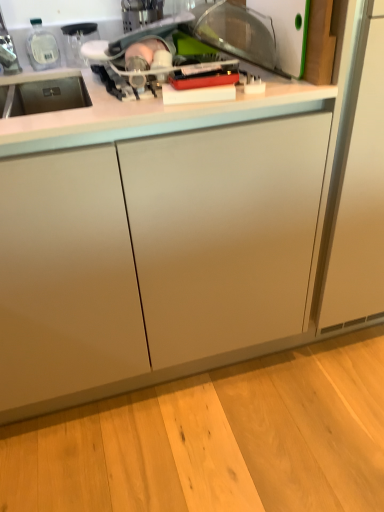
You are a GUI agent. You are given a task and a screenshot of the screen. Output one action in this format:
    pyautogui.click(x=<x>, y=<y>)
    Task: Click on the white glossy countertop at upper center
    This screenshot has height=512, width=384.
    Given the screenshot: What is the action you would take?
    pyautogui.click(x=150, y=117)

This screenshot has width=384, height=512. What do you see at coordinates (150, 117) in the screenshot? I see `white glossy countertop at upper center` at bounding box center [150, 117].

Locate an element on the screen. white plastic cutting board at upper right is located at coordinates (257, 32).

What do you see at coordinates (257, 32) in the screenshot? I see `white plastic cutting board at upper right` at bounding box center [257, 32].

Where is `white glossy countertop at upper center`? The image size is (384, 512). white glossy countertop at upper center is located at coordinates (150, 117).

Considering the relative positions of white plastic cutting board at upper right and white glossy countertop at upper center in the image provided, is white plastic cutting board at upper right to the right of white glossy countertop at upper center from the viewer's perspective?

Indeed, white plastic cutting board at upper right is positioned on the right side of white glossy countertop at upper center.

In the image, is white plastic cutting board at upper right positioned in front of or behind white glossy countertop at upper center?

white plastic cutting board at upper right is behind white glossy countertop at upper center.

Considering the points (251, 50) and (87, 87), which point is in front, point (251, 50) or point (87, 87)?

The point (87, 87) is closer.

From the image's perspective, is white plastic cutting board at upper right located above or below white glossy countertop at upper center?

Clearly, from the image's perspective, white plastic cutting board at upper right is above white glossy countertop at upper center.

From a real-world perspective, is white plastic cutting board at upper right positioned over white glossy countertop at upper center based on gravity?

No, from a real-world perspective, white plastic cutting board at upper right is not above white glossy countertop at upper center.

Can you confirm if white plastic cutting board at upper right is wider than white glossy countertop at upper center?

No, white plastic cutting board at upper right is not wider than white glossy countertop at upper center.

Can you confirm if white plastic cutting board at upper right is taller than white glossy countertop at upper center?

No, white plastic cutting board at upper right is not taller than white glossy countertop at upper center.

Between white plastic cutting board at upper right and white glossy countertop at upper center, which one has smaller size?

white plastic cutting board at upper right is smaller.

Could white glossy countertop at upper center be considered to be inside white plastic cutting board at upper right?

Actually, white glossy countertop at upper center is outside white plastic cutting board at upper right.

Would you say white plastic cutting board at upper right is a long distance from white glossy countertop at upper center?

white plastic cutting board at upper right is actually quite close to white glossy countertop at upper center.

Does white plastic cutting board at upper right turn towards white glossy countertop at upper center?

Yes, white plastic cutting board at upper right is oriented towards white glossy countertop at upper center.

What's the angular difference between white plastic cutting board at upper right and white glossy countertop at upper center's facing directions?

They differ by 87.7 degrees in their facing directions.

Measure the distance between white plastic cutting board at upper right and white glossy countertop at upper center.

white plastic cutting board at upper right is 7.50 inches from white glossy countertop at upper center.

Find the location of `appliance below the white glossy countertop at upper center (from a real-world perspective)`. appliance below the white glossy countertop at upper center (from a real-world perspective) is located at coordinates (257, 32).

Does white glossy countertop at upper center appear on the left side of white plastic cutting board at upper right?

Correct, you'll find white glossy countertop at upper center to the left of white plastic cutting board at upper right.

Which object is further away from the camera, white glossy countertop at upper center or white plastic cutting board at upper right?

white plastic cutting board at upper right is behind.

Is point (4, 135) closer to camera compared to point (284, 33)?

That is True.

From the image's perspective, would you say white glossy countertop at upper center is positioned over white plastic cutting board at upper right?

No, from the image's perspective, white glossy countertop at upper center is not over white plastic cutting board at upper right.

From a real-world perspective, is white glossy countertop at upper center positioned above or below white plastic cutting board at upper right?

white glossy countertop at upper center is situated higher than white plastic cutting board at upper right in the real world.

Which object is wider, white glossy countertop at upper center or white plastic cutting board at upper right?

Wider between the two is white glossy countertop at upper center.

Who is shorter, white glossy countertop at upper center or white plastic cutting board at upper right?

With less height is white plastic cutting board at upper right.

Does white glossy countertop at upper center have a smaller size compared to white plastic cutting board at upper right?

Incorrect, white glossy countertop at upper center is not smaller in size than white plastic cutting board at upper right.

Would you say white glossy countertop at upper center is inside or outside white plastic cutting board at upper right?

The correct answer is: outside.

Would you consider white glossy countertop at upper center to be distant from white plastic cutting board at upper right?

No, there isn't a large distance between white glossy countertop at upper center and white plastic cutting board at upper right.

Is white glossy countertop at upper center oriented away from white plastic cutting board at upper right?

No.

From the picture: Can you tell me how much white glossy countertop at upper center and white plastic cutting board at upper right differ in facing direction?

The angle between the facing direction of white glossy countertop at upper center and the facing direction of white plastic cutting board at upper right is 87.7 degrees.

How much distance is there between white glossy countertop at upper center and white plastic cutting board at upper right?

white glossy countertop at upper center is 7.50 inches away from white plastic cutting board at upper right.

Where is `countertop below the white plastic cutting board at upper right (from the image's perspective)`? The width and height of the screenshot is (384, 512). countertop below the white plastic cutting board at upper right (from the image's perspective) is located at coordinates tap(150, 117).

Where is `countertop that appears in front of the white plastic cutting board at upper right`? The height and width of the screenshot is (512, 384). countertop that appears in front of the white plastic cutting board at upper right is located at coordinates (150, 117).

Locate an element on the screen. Image resolution: width=384 pixels, height=512 pixels. countertop above the white plastic cutting board at upper right (from a real-world perspective) is located at coordinates (150, 117).